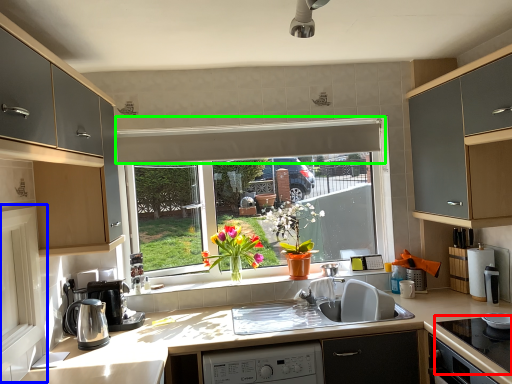
Question: Which is farther away from gas stove (highlighted by a red box)? screen door (highlighted by a blue box) or exhaust hood (highlighted by a green box)?

Choices:
 (A) screen door
 (B) exhaust hood

Answer: (A)